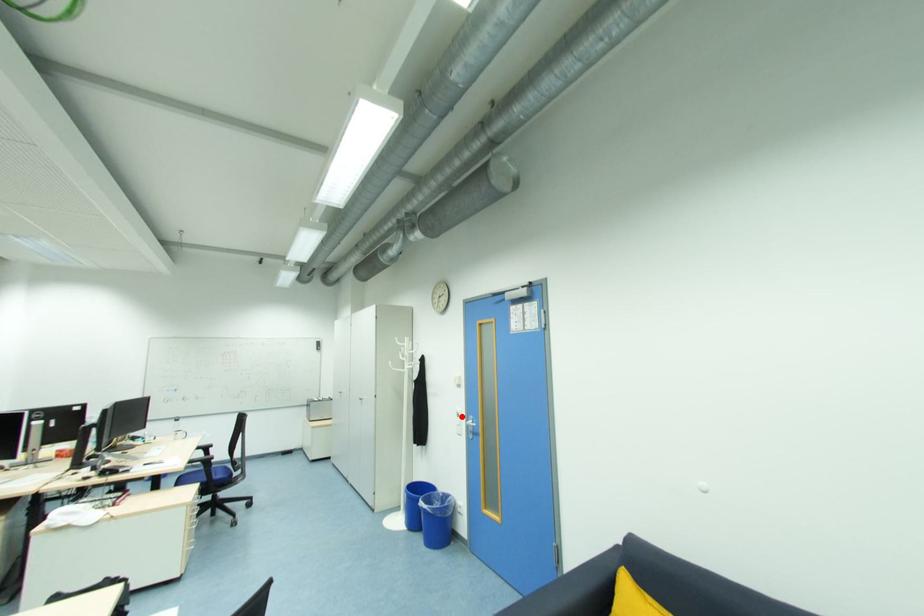
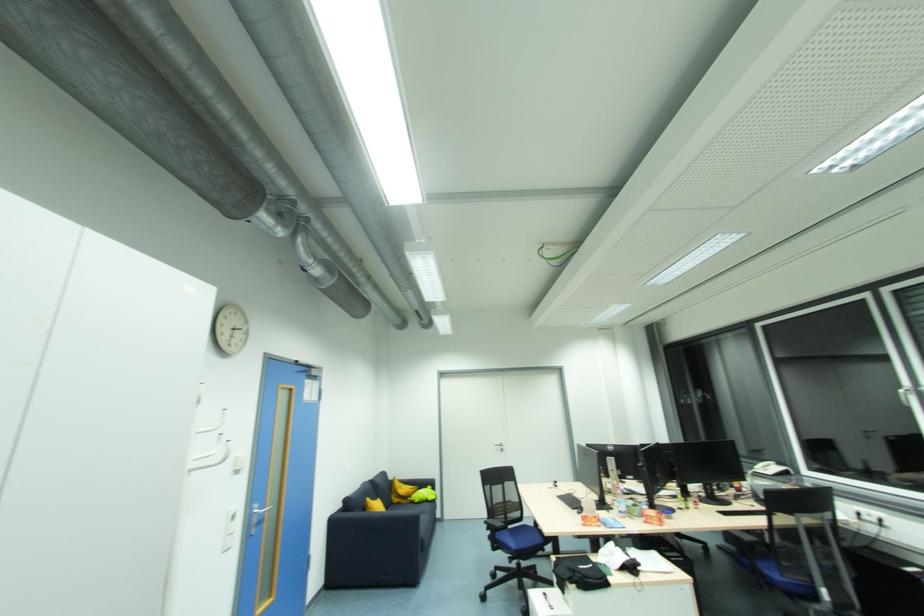
The point at the highlighted location is marked in the first image. Where is the corresponding point in the second image?

(236, 520)